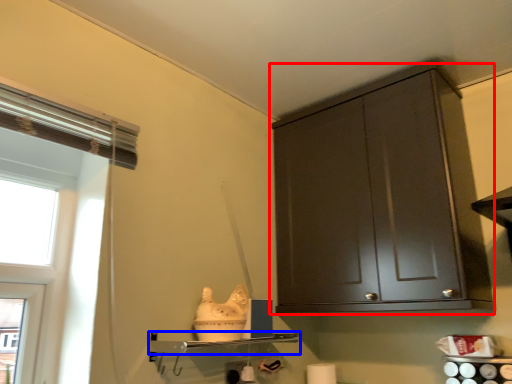
Question: Which object is closer to the camera taking this photo, cabinetry (highlighted by a red box) or shelf (highlighted by a blue box)?

Choices:
 (A) cabinetry
 (B) shelf

Answer: (B)